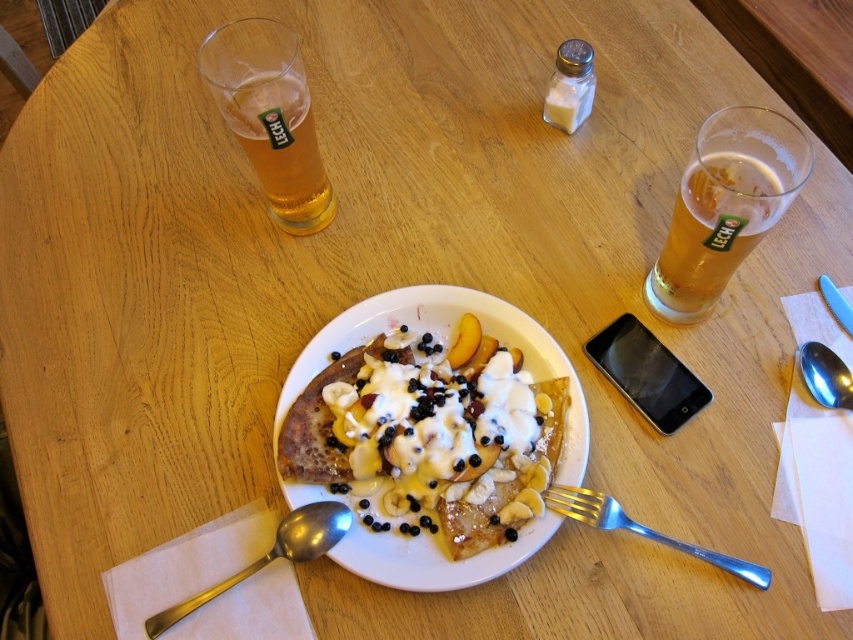
You are a server at a restaurant and need to present two satin silver spoons to customers. The scene shows a breakfast table with a plate of pancakes. You must choose between the satin silver spoon at lower left and the satin silver spoon at upper right. Which spoon should you choose if you want to give the taller one?

The satin silver spoon at lower left is taller than the satin silver spoon at upper right, so you should choose the satin silver spoon at lower left.

You are a guest at a brunch and want to reach for the golden crispy crepe topped with cream, fruit, and blueberries at center. However, there is a silver metallic fork at lower right in the way. Can you easily access the crepe without moving the fork?

The golden crispy crepe topped with cream, fruit, and blueberries at center is in front of the silver metallic fork at lower right, so it is closer to you. Therefore, you can easily access the crepe without needing to move the fork.

You are a server at a restaurant and need to choose a spoon that can hold more syrup. Which spoon should you pick between the satin silver spoon at lower left and the satin silver spoon at upper right?

The satin silver spoon at lower left has a greater width than the satin silver spoon at upper right, so it can hold more syrup.